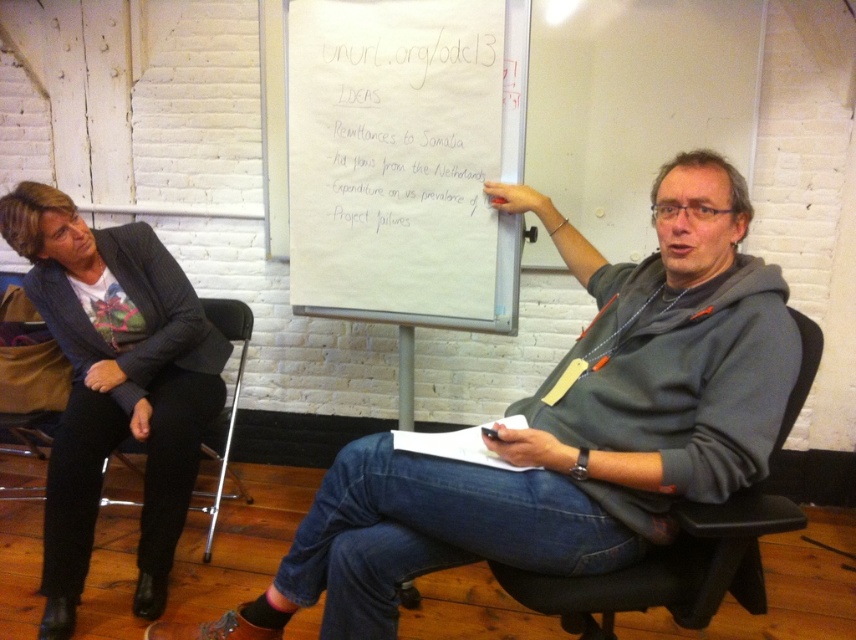
Question: Does black leather chair at center have a larger size compared to metallic black chair at lower left?

Choices:
 (A) no
 (B) yes

Answer: (A)

Question: Can you confirm if whiteboard at center is positioned to the left of metallic black chair at lower left?

Choices:
 (A) yes
 (B) no

Answer: (B)

Question: Which of the following is the farthest from the observer?

Choices:
 (A) (163, 598)
 (B) (247, 332)

Answer: (B)

Question: Among these points, which one is farthest from the camera?

Choices:
 (A) (663, 330)
 (B) (99, 289)
 (C) (794, 512)
 (D) (236, 493)

Answer: (D)

Question: Which object is closer to the camera taking this photo?

Choices:
 (A) metallic black chair at lower left
 (B) whiteboard at center

Answer: (B)

Question: Considering the relative positions of gray hoodie at center and metallic black chair at lower left in the image provided, where is gray hoodie at center located with respect to metallic black chair at lower left?

Choices:
 (A) above
 (B) below

Answer: (A)